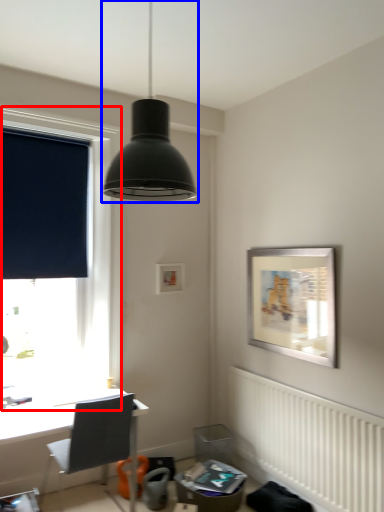
Question: Which object appears farthest to the camera in this image, window (highlighted by a red box) or lamp (highlighted by a blue box)?

Choices:
 (A) window
 (B) lamp

Answer: (A)